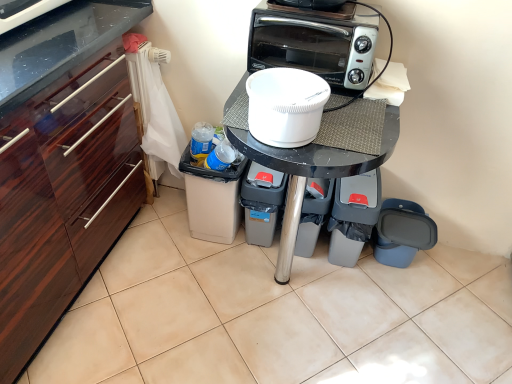
Find the location of a particular element. The width and height of the screenshot is (512, 384). vacant region below black glossy table at center (from a real-world perspective) is located at coordinates (281, 288).